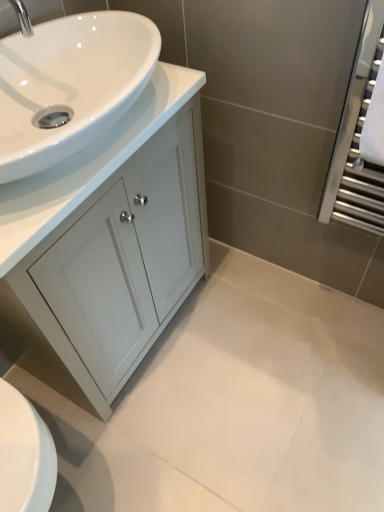
Question: Is silver metallic tap at upper left touching white glossy cabinet at left?

Choices:
 (A) yes
 (B) no

Answer: (B)

Question: From the image's perspective, is silver metallic tap at upper left on white glossy cabinet at left?

Choices:
 (A) no
 (B) yes

Answer: (B)

Question: Is the position of silver metallic tap at upper left more distant than that of white glossy cabinet at left?

Choices:
 (A) yes
 (B) no

Answer: (B)

Question: Considering the relative sizes of silver metallic tap at upper left and white glossy cabinet at left in the image provided, is silver metallic tap at upper left smaller than white glossy cabinet at left?

Choices:
 (A) no
 (B) yes

Answer: (B)

Question: Would you say white glossy cabinet at left is part of silver metallic tap at upper left's contents?

Choices:
 (A) yes
 (B) no

Answer: (B)

Question: Is silver metallic tap at upper left positioned with its back to white glossy cabinet at left?

Choices:
 (A) yes
 (B) no

Answer: (B)

Question: Considering the relative positions of white glossy sink at upper left and silver metallic tap at upper left in the image provided, is white glossy sink at upper left to the left of silver metallic tap at upper left from the viewer's perspective?

Choices:
 (A) no
 (B) yes

Answer: (A)

Question: Can you confirm if white glossy sink at upper left is taller than silver metallic tap at upper left?

Choices:
 (A) yes
 (B) no

Answer: (A)

Question: Can you confirm if white glossy sink at upper left is thinner than silver metallic tap at upper left?

Choices:
 (A) no
 (B) yes

Answer: (A)

Question: Is white glossy sink at upper left at the right side of silver metallic tap at upper left?

Choices:
 (A) yes
 (B) no

Answer: (A)

Question: Considering the relative sizes of white glossy sink at upper left and silver metallic tap at upper left in the image provided, is white glossy sink at upper left bigger than silver metallic tap at upper left?

Choices:
 (A) no
 (B) yes

Answer: (B)

Question: From a real-world perspective, is white glossy sink at upper left positioned over silver metallic tap at upper left based on gravity?

Choices:
 (A) yes
 (B) no

Answer: (B)

Question: Considering the relative sizes of white glossy cabinet at left and silver metallic tap at upper left in the image provided, is white glossy cabinet at left taller than silver metallic tap at upper left?

Choices:
 (A) no
 (B) yes

Answer: (B)